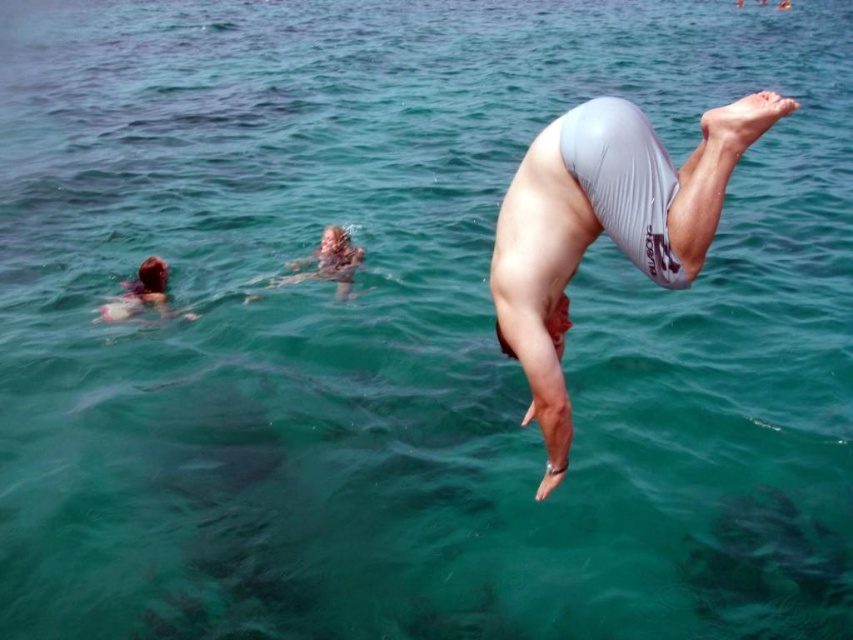
You are a photographer trying to capture the perfect shot of the white matte shorts at center during the dive. Based on their current position coordinates, can you estimate whether they will be in the center of the frame when the diver enters the water?

The white matte shorts at center are positioned at coordinates point [604,227], which means they are slightly off the exact center of the frame. Therefore, they will not be perfectly centered when the diver enters the water.

You are a lifeguard on duty and need to assess the distance between the white matte shorts at center and the blonde hair swimmer at left. Based on the image, can you confirm if the distance is more than 5 meters?

The white matte shorts at center is 6.83 meters from blonde hair swimmer at left, so yes, the distance is more than 5 meters.